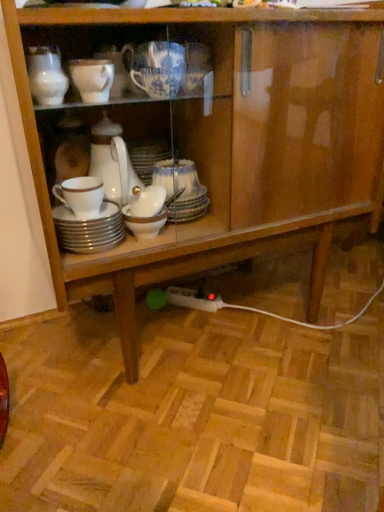
Looking at this image, what is the approximate width of white glossy plates at center, which ranks as the first tableware in bottom-to-top order?

13.28 centimeters.

Measure the distance between white glossy plates at center, which ranks as the first tableware in bottom-to-top order, and camera.

The distance of white glossy plates at center, which ranks as the first tableware in bottom-to-top order, from camera is 32.22 inches.

The width and height of the screenshot is (384, 512). What do you see at coordinates (89, 229) in the screenshot?
I see `white glossy plates at center, which is the 2th tableware in right-to-left order` at bounding box center [89, 229].

At what (x,y) coordinates should I click in order to perform the action: click on white glossy plates at center, the 2th tableware in the top-to-bottom sequence. Please return your answer as a coordinate pair (x, y). Image resolution: width=384 pixels, height=512 pixels. Looking at the image, I should click on (89, 229).

Based on the photo, measure the distance between point (138, 67) and camera.

Point (138, 67) is 77.30 centimeters away from camera.

This screenshot has height=512, width=384. I want to click on blue and white porcelain cup at upper center, placed as the 2th tableware when sorted from left to right, so click(x=156, y=68).

What do you see at coordinates (156, 68) in the screenshot?
I see `blue and white porcelain cup at upper center, which ranks as the 1th tableware in right-to-left order` at bounding box center [156, 68].

The image size is (384, 512). Identify the location of white glossy plates at center, which ranks as the first tableware in bottom-to-top order. (89, 229).

Which object is positioned more to the right, white glossy plates at center, which is counted as the 1th tableware, starting from the left, or blue and white porcelain cup at upper center, acting as the 1th tableware starting from the top?

Positioned to the right is blue and white porcelain cup at upper center, acting as the 1th tableware starting from the top.

Considering the relative positions of white glossy plates at center, the 2th tableware in the top-to-bottom sequence, and blue and white porcelain cup at upper center, placed as the 2th tableware when sorted from left to right, in the image provided, is white glossy plates at center, the 2th tableware in the top-to-bottom sequence, behind blue and white porcelain cup at upper center, placed as the 2th tableware when sorted from left to right,?

Yes, white glossy plates at center, the 2th tableware in the top-to-bottom sequence, is further from the viewer.

Which is less distant, (92, 237) or (146, 60)?

Point (92, 237) is positioned farther from the camera compared to point (146, 60).

From the image's perspective, would you say white glossy plates at center, which is counted as the 1th tableware, starting from the left, is positioned over blue and white porcelain cup at upper center, acting as the 1th tableware starting from the top?

No, from the image's perspective, white glossy plates at center, which is counted as the 1th tableware, starting from the left, is not on top of blue and white porcelain cup at upper center, acting as the 1th tableware starting from the top.

Looking at this image, from a real-world perspective, which is physically above, white glossy plates at center, which is the 2th tableware in right-to-left order, or blue and white porcelain cup at upper center, acting as the 1th tableware starting from the top?

From a 3D spatial view, blue and white porcelain cup at upper center, acting as the 1th tableware starting from the top, is above.

Considering the sizes of white glossy plates at center, which ranks as the first tableware in bottom-to-top order, and blue and white porcelain cup at upper center, acting as the 1th tableware starting from the top, in the image, is white glossy plates at center, which ranks as the first tableware in bottom-to-top order, wider or thinner than blue and white porcelain cup at upper center, acting as the 1th tableware starting from the top,?

In the image, white glossy plates at center, which ranks as the first tableware in bottom-to-top order, appears to be wider than blue and white porcelain cup at upper center, acting as the 1th tableware starting from the top.

From the picture: Can you confirm if white glossy plates at center, which is the 2th tableware in right-to-left order, is shorter than blue and white porcelain cup at upper center, acting as the 1th tableware starting from the top?

Yes, white glossy plates at center, which is the 2th tableware in right-to-left order, is shorter than blue and white porcelain cup at upper center, acting as the 1th tableware starting from the top.

Considering the sizes of white glossy plates at center, which is the 2th tableware in right-to-left order, and blue and white porcelain cup at upper center, acting as the 1th tableware starting from the top, in the image, is white glossy plates at center, which is the 2th tableware in right-to-left order, bigger or smaller than blue and white porcelain cup at upper center, acting as the 1th tableware starting from the top,?

In the image, white glossy plates at center, which is the 2th tableware in right-to-left order, appears to be smaller than blue and white porcelain cup at upper center, acting as the 1th tableware starting from the top.

Looking at this image, is white glossy plates at center, which is counted as the 1th tableware, starting from the left, not inside blue and white porcelain cup at upper center, placed as the 2th tableware when sorted from left to right?

Indeed, white glossy plates at center, which is counted as the 1th tableware, starting from the left, is completely outside blue and white porcelain cup at upper center, placed as the 2th tableware when sorted from left to right.

Is there a large distance between white glossy plates at center, which is counted as the 1th tableware, starting from the left, and blue and white porcelain cup at upper center, placed as the 2th tableware when sorted from left to right?

That's not correct — white glossy plates at center, which is counted as the 1th tableware, starting from the left, is a little close to blue and white porcelain cup at upper center, placed as the 2th tableware when sorted from left to right.

Does white glossy plates at center, which is counted as the 1th tableware, starting from the left, turn towards blue and white porcelain cup at upper center, the second tableware in the bottom-to-top sequence?

No, white glossy plates at center, which is counted as the 1th tableware, starting from the left, is not facing towards blue and white porcelain cup at upper center, the second tableware in the bottom-to-top sequence.

How different are the orientations of white glossy plates at center, which is counted as the 1th tableware, starting from the left, and blue and white porcelain cup at upper center, which ranks as the 1th tableware in right-to-left order, in degrees?

The angular difference between white glossy plates at center, which is counted as the 1th tableware, starting from the left, and blue and white porcelain cup at upper center, which ranks as the 1th tableware in right-to-left order, is 0.000622 degrees.

This screenshot has width=384, height=512. What are the coordinates of `tableware lying on the left of blue and white porcelain cup at upper center, placed as the 2th tableware when sorted from left to right` in the screenshot? It's located at (89, 229).

Is blue and white porcelain cup at upper center, placed as the 2th tableware when sorted from left to right, to the right of white glossy plates at center, which is counted as the 1th tableware, starting from the left, from the viewer's perspective?

Yes, blue and white porcelain cup at upper center, placed as the 2th tableware when sorted from left to right, is to the right of white glossy plates at center, which is counted as the 1th tableware, starting from the left.

Relative to white glossy plates at center, which ranks as the first tableware in bottom-to-top order, is blue and white porcelain cup at upper center, acting as the 1th tableware starting from the top, in front or behind?

Clearly, blue and white porcelain cup at upper center, acting as the 1th tableware starting from the top, is in front of white glossy plates at center, which ranks as the first tableware in bottom-to-top order.

Between point (165, 73) and point (124, 228), which one is positioned behind?

The point (124, 228) is behind.

From the picture: From the image's perspective, which one is positioned higher, blue and white porcelain cup at upper center, placed as the 2th tableware when sorted from left to right, or white glossy plates at center, which ranks as the first tableware in bottom-to-top order?

From the image's view, blue and white porcelain cup at upper center, placed as the 2th tableware when sorted from left to right, is above.

From a real-world perspective, is blue and white porcelain cup at upper center, which ranks as the 1th tableware in right-to-left order, physically located above or below white glossy plates at center, the 2th tableware in the top-to-bottom sequence?

In terms of real-world spatial position, blue and white porcelain cup at upper center, which ranks as the 1th tableware in right-to-left order, is above white glossy plates at center, the 2th tableware in the top-to-bottom sequence.

Is blue and white porcelain cup at upper center, the second tableware in the bottom-to-top sequence, wider or thinner than white glossy plates at center, the 2th tableware in the top-to-bottom sequence?

Considering their sizes, blue and white porcelain cup at upper center, the second tableware in the bottom-to-top sequence, looks slimmer than white glossy plates at center, the 2th tableware in the top-to-bottom sequence.

Is blue and white porcelain cup at upper center, the second tableware in the bottom-to-top sequence, taller than white glossy plates at center, which ranks as the first tableware in bottom-to-top order?

Indeed, blue and white porcelain cup at upper center, the second tableware in the bottom-to-top sequence, has a greater height compared to white glossy plates at center, which ranks as the first tableware in bottom-to-top order.

Is blue and white porcelain cup at upper center, the second tableware in the bottom-to-top sequence, bigger than white glossy plates at center, which is counted as the 1th tableware, starting from the left?

Yes.

Is white glossy plates at center, which is counted as the 1th tableware, starting from the left, located within blue and white porcelain cup at upper center, acting as the 1th tableware starting from the top?

No, white glossy plates at center, which is counted as the 1th tableware, starting from the left, is not surrounded by blue and white porcelain cup at upper center, acting as the 1th tableware starting from the top.

Are blue and white porcelain cup at upper center, which ranks as the 1th tableware in right-to-left order, and white glossy plates at center, the 2th tableware in the top-to-bottom sequence, far apart?

blue and white porcelain cup at upper center, which ranks as the 1th tableware in right-to-left order, is actually quite close to white glossy plates at center, the 2th tableware in the top-to-bottom sequence.

Is blue and white porcelain cup at upper center, the second tableware in the bottom-to-top sequence, looking in the opposite direction of white glossy plates at center, which is the 2th tableware in right-to-left order?

blue and white porcelain cup at upper center, the second tableware in the bottom-to-top sequence, is not turned away from white glossy plates at center, which is the 2th tableware in right-to-left order.

What's the angular difference between blue and white porcelain cup at upper center, which ranks as the 1th tableware in right-to-left order, and white glossy plates at center, which ranks as the first tableware in bottom-to-top order,'s facing directions?

They differ by 0.000622 degrees in their facing directions.

How much distance is there between blue and white porcelain cup at upper center, the second tableware in the bottom-to-top sequence, and white glossy plates at center, which ranks as the first tableware in bottom-to-top order?

blue and white porcelain cup at upper center, the second tableware in the bottom-to-top sequence, and white glossy plates at center, which ranks as the first tableware in bottom-to-top order, are 11.11 inches apart.

Find the location of a particular element. tableware behind the blue and white porcelain cup at upper center, acting as the 1th tableware starting from the top is located at coordinates (89, 229).

Identify the location of tableware to the right of white glossy plates at center, which is the 2th tableware in right-to-left order. The image size is (384, 512). (156, 68).

The height and width of the screenshot is (512, 384). What are the coordinates of `tableware in front of the white glossy plates at center, which is counted as the 1th tableware, starting from the left` in the screenshot? It's located at (156, 68).